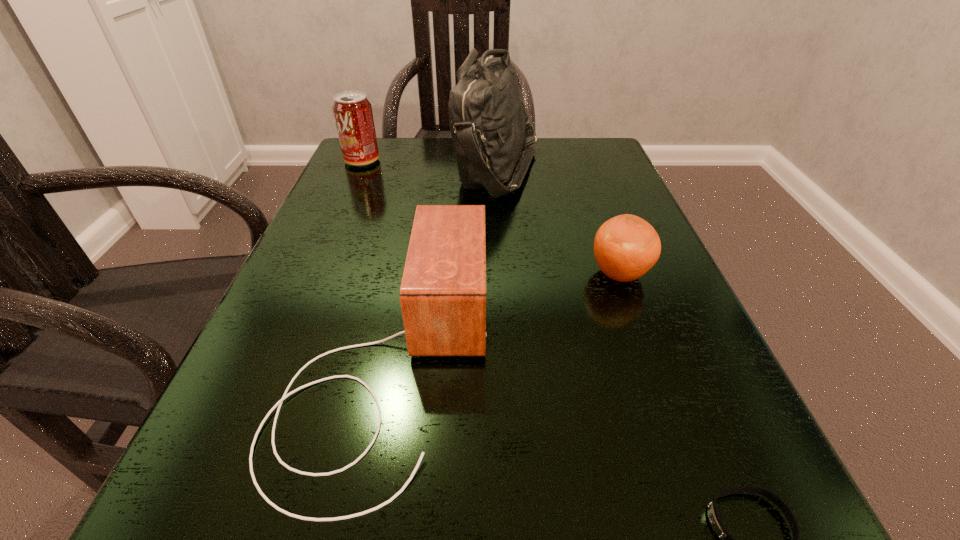
The width and height of the screenshot is (960, 540). I want to click on shoulder bag, so click(x=490, y=126).

I want to click on soda can, so [x=353, y=115].

At what (x,y) coordinates should I click in order to perform the action: click on radio receiver. Please return your answer as a coordinate pair (x, y). Image resolution: width=960 pixels, height=540 pixels. Looking at the image, I should click on (443, 291).

Locate an element on the screen. the second shortest object is located at coordinates (625, 247).

I want to click on vacant space positioned 0.100m at the front padded panel of the tallest object, so click(x=411, y=168).

This screenshot has width=960, height=540. In order to click on vacant space situated at the front padded panel of the tallest object in this screenshot , I will do `click(411, 168)`.

Locate an element on the screen. vacant region located at the front padded panel of the tallest object is located at coordinates (397, 168).

Identify the location of vacant region located on the right of the soda can. The image size is (960, 540). (506, 161).

Where is `free space located on the front-facing side of the radio receiver`? free space located on the front-facing side of the radio receiver is located at coordinates pyautogui.click(x=612, y=361).

Where is `free space located 0.320m on the front of the second shortest object`? The image size is (960, 540). free space located 0.320m on the front of the second shortest object is located at coordinates (704, 504).